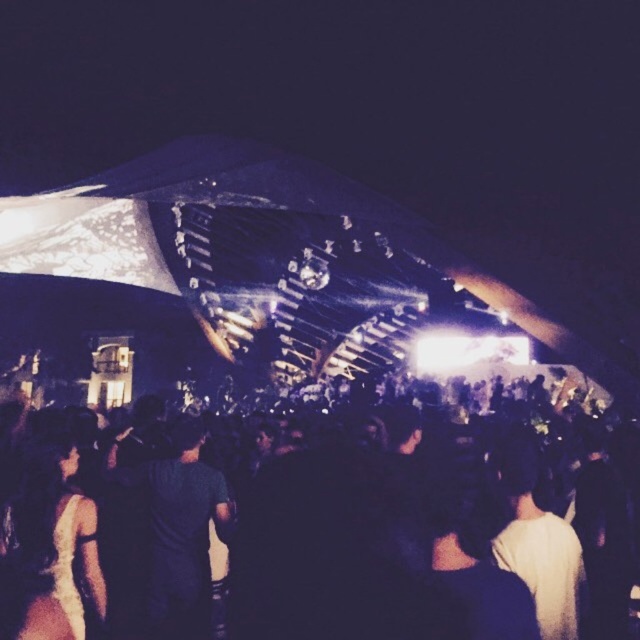
You are a photographer at the concert. You want to take a photo that includes both the dark gray shirt at center and the white matte dress at lower left. Which object should you focus on first to ensure both are in frame?

The dark gray shirt at center is taller than the white matte dress at lower left, so you should focus on the dark gray shirt at center first to ensure both are in frame.